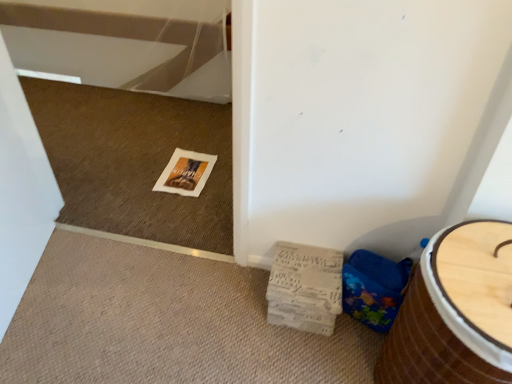
Question: From a real-world perspective, does wooden barrel at lower right sit lower than blue fabric potty at lower right?

Choices:
 (A) yes
 (B) no

Answer: (B)

Question: Considering the relative positions of wooden barrel at lower right and blue fabric potty at lower right in the image provided, is wooden barrel at lower right to the left of blue fabric potty at lower right from the viewer's perspective?

Choices:
 (A) yes
 (B) no

Answer: (B)

Question: Is the surface of wooden barrel at lower right in direct contact with blue fabric potty at lower right?

Choices:
 (A) yes
 (B) no

Answer: (B)

Question: Is wooden barrel at lower right not close to blue fabric potty at lower right?

Choices:
 (A) yes
 (B) no

Answer: (B)

Question: Is the position of wooden barrel at lower right more distant than that of blue fabric potty at lower right?

Choices:
 (A) no
 (B) yes

Answer: (A)

Question: Considering their positions, is wooden barrel at lower right located in front of or behind blue fabric potty at lower right?

Choices:
 (A) behind
 (B) front

Answer: (B)

Question: Based on their sizes in the image, would you say wooden barrel at lower right is bigger or smaller than blue fabric potty at lower right?

Choices:
 (A) big
 (B) small

Answer: (A)

Question: In terms of width, does wooden barrel at lower right look wider or thinner when compared to blue fabric potty at lower right?

Choices:
 (A) wide
 (B) thin

Answer: (A)

Question: In terms of height, does wooden barrel at lower right look taller or shorter compared to blue fabric potty at lower right?

Choices:
 (A) short
 (B) tall

Answer: (B)

Question: Is white cardboard magazine at lower right inside or outside of blue fabric potty at lower right?

Choices:
 (A) outside
 (B) inside

Answer: (A)

Question: Based on their positions, is white cardboard magazine at lower right located to the left or right of blue fabric potty at lower right?

Choices:
 (A) left
 (B) right

Answer: (A)

Question: Considering the positions of point tap(306, 314) and point tap(355, 284), is point tap(306, 314) closer or farther from the camera than point tap(355, 284)?

Choices:
 (A) farther
 (B) closer

Answer: (A)

Question: From the image's perspective, is white cardboard magazine at lower right positioned above or below blue fabric potty at lower right?

Choices:
 (A) below
 (B) above

Answer: (B)

Question: Would you say blue fabric potty at lower right is to the left or to the right of wooden barrel at lower right in the picture?

Choices:
 (A) left
 (B) right

Answer: (A)

Question: In the image, is blue fabric potty at lower right positioned in front of or behind wooden barrel at lower right?

Choices:
 (A) behind
 (B) front

Answer: (A)